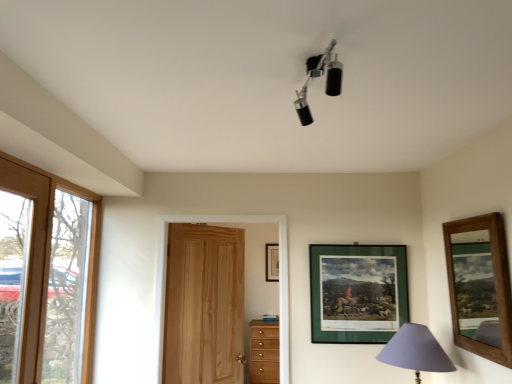
You are a GUI agent. You are given a task and a screenshot of the screen. Output one action in this format:
    pyautogui.click(x=<x>, y=<y>)
    Task: Click on the clear glass window at left
    
    Given the screenshot: What is the action you would take?
    pyautogui.click(x=45, y=277)

The width and height of the screenshot is (512, 384). What do you see at coordinates (45, 277) in the screenshot? I see `clear glass window at left` at bounding box center [45, 277].

The image size is (512, 384). I want to click on light brown wooden chest of drawers at lower center, so click(x=264, y=352).

Describe the element at coordinates (272, 262) in the screenshot. I see `wooden picture frame at upper center, placed as the third picture frame when sorted from right to left` at that location.

What do you see at coordinates (480, 287) in the screenshot? I see `wooden framed mirror at right, which ranks as the 3th picture frame in back-to-front order` at bounding box center [480, 287].

This screenshot has height=384, width=512. What are the coordinates of `clear glass window at left` in the screenshot? It's located at (45, 277).

Is wooden picture frame at upper center, placed as the first picture frame when sorted from back to front, facing away from light brown wooden chest of drawers at lower center?

No.

From the image's perspective, is wooden picture frame at upper center, placed as the third picture frame when sorted from right to left, under light brown wooden chest of drawers at lower center?

No.

From a real-world perspective, is wooden picture frame at upper center, placed as the first picture frame when sorted from back to front, physically above light brown wooden chest of drawers at lower center?

Correct, in the physical world, wooden picture frame at upper center, placed as the first picture frame when sorted from back to front, is higher than light brown wooden chest of drawers at lower center.

Does wooden picture frame at upper center, placed as the third picture frame when sorted from right to left, have a greater height compared to green matte picture frame at upper center, placed as the second picture frame when sorted from front to back?

Incorrect, the height of wooden picture frame at upper center, placed as the third picture frame when sorted from right to left, is not larger of that of green matte picture frame at upper center, placed as the second picture frame when sorted from front to back.

Which point is more forward, (x=275, y=267) or (x=334, y=332)?

Positioned in front is point (x=334, y=332).

Is the surface of wooden picture frame at upper center, placed as the 3th picture frame when sorted from front to back, in direct contact with green matte picture frame at upper center, the second picture frame in the back-to-front sequence?

No.

Does wooden picture frame at upper center, placed as the third picture frame when sorted from right to left, contain green matte picture frame at upper center, the second picture frame in the back-to-front sequence?

No, green matte picture frame at upper center, the second picture frame in the back-to-front sequence, is not inside wooden picture frame at upper center, placed as the third picture frame when sorted from right to left.

Considering the sizes of objects light brown wooden chest of drawers at lower center and clear glass window at left in the image provided, who is shorter, light brown wooden chest of drawers at lower center or clear glass window at left?

With less height is light brown wooden chest of drawers at lower center.

Is light brown wooden chest of drawers at lower center located outside clear glass window at left?

light brown wooden chest of drawers at lower center is positioned outside clear glass window at left.

From a real-world perspective, who is located higher, light brown wooden chest of drawers at lower center or clear glass window at left?

In real-world perspective, clear glass window at left is above.

Is light brown wooden chest of drawers at lower center far from clear glass window at left?

Absolutely, light brown wooden chest of drawers at lower center is distant from clear glass window at left.

Does green matte picture frame at upper center, placed as the second picture frame when sorted from front to back, appear on the left side of wooden framed mirror at right, the 1th picture frame in the right-to-left sequence?

Indeed, green matte picture frame at upper center, placed as the second picture frame when sorted from front to back, is positioned on the left side of wooden framed mirror at right, the 1th picture frame in the right-to-left sequence.

What's the angular difference between green matte picture frame at upper center, placed as the second picture frame when sorted from front to back, and wooden framed mirror at right, marked as the 1th picture frame in a front-to-back arrangement,'s facing directions?

→ The facing directions of green matte picture frame at upper center, placed as the second picture frame when sorted from front to back, and wooden framed mirror at right, marked as the 1th picture frame in a front-to-back arrangement, are 90.1 degrees apart.

Is green matte picture frame at upper center, the second picture frame in the back-to-front sequence, aimed at wooden framed mirror at right, which ranks as the 3th picture frame in back-to-front order?

Yes, green matte picture frame at upper center, the second picture frame in the back-to-front sequence, is oriented towards wooden framed mirror at right, which ranks as the 3th picture frame in back-to-front order.

Is there a large distance between green matte picture frame at upper center, the second picture frame positioned from the left, and wooden framed mirror at right, the 1th picture frame in the right-to-left sequence?

They are positioned close to each other.

Between black matte spotlights at upper center, marked as the second lamp in a back-to-front arrangement, and wooden framed mirror at right, which ranks as the 3th picture frame in back-to-front order, which one appears on the left side from the viewer's perspective?

black matte spotlights at upper center, marked as the second lamp in a back-to-front arrangement, is more to the left.

Is black matte spotlights at upper center, marked as the first lamp in a left-to-right arrangement, next to wooden framed mirror at right, which appears as the third picture frame when viewed from the left?

No, black matte spotlights at upper center, marked as the first lamp in a left-to-right arrangement, is not with wooden framed mirror at right, which appears as the third picture frame when viewed from the left.

How many degrees apart are the facing directions of black matte spotlights at upper center, marked as the first lamp in a left-to-right arrangement, and wooden framed mirror at right, which ranks as the 3th picture frame in back-to-front order?

The facing directions of black matte spotlights at upper center, marked as the first lamp in a left-to-right arrangement, and wooden framed mirror at right, which ranks as the 3th picture frame in back-to-front order, are 104 degrees apart.

From the image's perspective, relative to wooden framed mirror at right, the 1th picture frame in the right-to-left sequence, is black matte spotlights at upper center, marked as the first lamp in a left-to-right arrangement, above or below?

black matte spotlights at upper center, marked as the first lamp in a left-to-right arrangement, is situated higher than wooden framed mirror at right, the 1th picture frame in the right-to-left sequence, in the image.

Do you think natural wood door at center is within black matte spotlights at upper center, arranged as the first lamp when viewed from the top, or outside of it?

natural wood door at center is not enclosed by black matte spotlights at upper center, arranged as the first lamp when viewed from the top.

Is natural wood door at center positioned with its back to black matte spotlights at upper center, which appears as the 2th lamp when ordered from the bottom?

That's not correct — natural wood door at center is not looking away from black matte spotlights at upper center, which appears as the 2th lamp when ordered from the bottom.

Which point is more distant from viewer, (166, 287) or (298, 104)?

The point (166, 287) is farther.

From the image's perspective, is natural wood door at center located above or below black matte spotlights at upper center, which appears as the 2th lamp when ordered from the bottom?

natural wood door at center is situated lower than black matte spotlights at upper center, which appears as the 2th lamp when ordered from the bottom, in the image.

Considering the positions of point (360, 318) and point (250, 379), is point (360, 318) closer or farther from the camera than point (250, 379)?

Point (360, 318) is closer to the camera than point (250, 379).

Consider the image. Is light brown wooden chest of drawers at lower center inside green matte picture frame at upper center, the second picture frame positioned from the left?

Definitely not — light brown wooden chest of drawers at lower center is not inside green matte picture frame at upper center, the second picture frame positioned from the left.

What's the angular difference between green matte picture frame at upper center, the second picture frame positioned from the left, and light brown wooden chest of drawers at lower center's facing directions?

The angular difference between green matte picture frame at upper center, the second picture frame positioned from the left, and light brown wooden chest of drawers at lower center is 4.18 degrees.

Looking at their sizes, would you say green matte picture frame at upper center, which is the 2th picture frame in right-to-left order, is wider or thinner than light brown wooden chest of drawers at lower center?

green matte picture frame at upper center, which is the 2th picture frame in right-to-left order, is thinner than light brown wooden chest of drawers at lower center.

The height and width of the screenshot is (384, 512). Find the location of `chest of drawers lying on the left of wooden picture frame at upper center, placed as the first picture frame when sorted from left to right`. chest of drawers lying on the left of wooden picture frame at upper center, placed as the first picture frame when sorted from left to right is located at coordinates (264, 352).

Starting from the wooden picture frame at upper center, placed as the first picture frame when sorted from back to front, which picture frame is the 1st one in front? Please provide its 2D coordinates.

[(357, 293)]

From the image, which object appears to be farther from purple fabric lampshade at lower right, which is the first lamp from back to front, green matte picture frame at upper center, placed as the second picture frame when sorted from front to back, or light brown wooden chest of drawers at lower center?

Based on the image, light brown wooden chest of drawers at lower center appears to be further to purple fabric lampshade at lower right, which is the first lamp from back to front.

Looking at the image, which one is located further to natural wood door at center, black matte spotlights at upper center, arranged as the first lamp when viewed from the top, or purple fabric lampshade at lower right, the 2th lamp from the left?

black matte spotlights at upper center, arranged as the first lamp when viewed from the top, is further to natural wood door at center.

Which object lies further to the anchor point wooden framed mirror at right, which ranks as the 3th picture frame in back-to-front order, clear glass window at left or purple fabric lampshade at lower right, which is the first lamp from back to front?

clear glass window at left is further to wooden framed mirror at right, which ranks as the 3th picture frame in back-to-front order.

Estimate the real-world distances between objects in this image. Which object is closer to light brown wooden chest of drawers at lower center, purple fabric lampshade at lower right, the 2th lamp from the left, or natural wood door at center?

natural wood door at center is positioned closer to the anchor light brown wooden chest of drawers at lower center.

Estimate the real-world distances between objects in this image. Which object is closer to natural wood door at center, purple fabric lampshade at lower right, acting as the first lamp starting from the right, or light brown wooden chest of drawers at lower center?

light brown wooden chest of drawers at lower center is positioned closer to the anchor natural wood door at center.

Considering their positions, is wooden picture frame at upper center, placed as the first picture frame when sorted from left to right, positioned closer to wooden framed mirror at right, which appears as the third picture frame when viewed from the left, than natural wood door at center?

Based on the image, wooden picture frame at upper center, placed as the first picture frame when sorted from left to right, appears to be nearer to wooden framed mirror at right, which appears as the third picture frame when viewed from the left.

Based on their spatial positions, is light brown wooden chest of drawers at lower center or black matte spotlights at upper center, marked as the first lamp in a left-to-right arrangement, closer to natural wood door at center?

light brown wooden chest of drawers at lower center.

Considering their positions, is green matte picture frame at upper center, which is the 2th picture frame in right-to-left order, positioned further to purple fabric lampshade at lower right, acting as the first lamp starting from the right, than black matte spotlights at upper center, marked as the second lamp in a back-to-front arrangement?

Based on the image, black matte spotlights at upper center, marked as the second lamp in a back-to-front arrangement, appears to be further to purple fabric lampshade at lower right, acting as the first lamp starting from the right.

I want to click on lamp positioned between clear glass window at left and light brown wooden chest of drawers at lower center from near to far, so click(x=415, y=351).

The image size is (512, 384). In order to click on picture frame positioned between natural wood door at center and wooden picture frame at upper center, placed as the third picture frame when sorted from right to left, from near to far in this screenshot , I will do `click(357, 293)`.

Find the location of a particular element. The image size is (512, 384). door between clear glass window at left and light brown wooden chest of drawers at lower center from front to back is located at coordinates (204, 305).

Locate an element on the screen. The image size is (512, 384). picture frame between black matte spotlights at upper center, arranged as the first lamp when viewed from the top, and natural wood door at center from front to back is located at coordinates (480, 287).